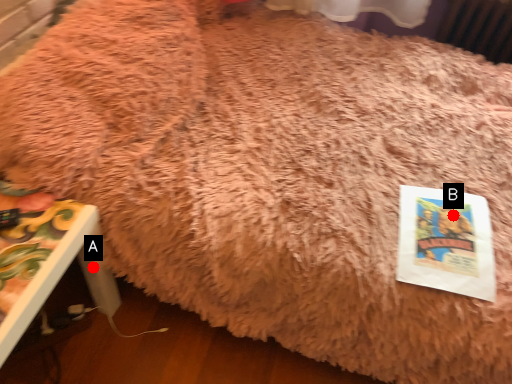
Question: Two points are circled on the image, labeled by A and B beside each circle. Which point appears farthest from the camera in this image?

Choices:
 (A) A is further
 (B) B is further

Answer: (A)